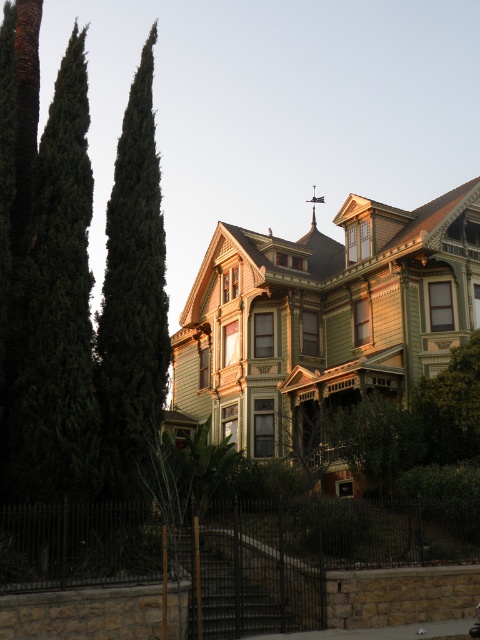
You are standing in front of the Victorian house and want to walk towards the metallic spire at upper center. Which direction should you move relative to the green textured tree at left?

You should move to the right relative to the green textured tree at left because the metallic spire at upper center is to the right of the green textured tree at left.

You are a delivery person trying to navigate to the front door of the Victorian house. You see the green textured tree at left and the metallic spire at upper center. Which object is closer to the front door?

The green textured tree at left is closer to the front door than the metallic spire at upper center because the tree is positioned at the left side of the house, while the spire is located higher up on the roof.